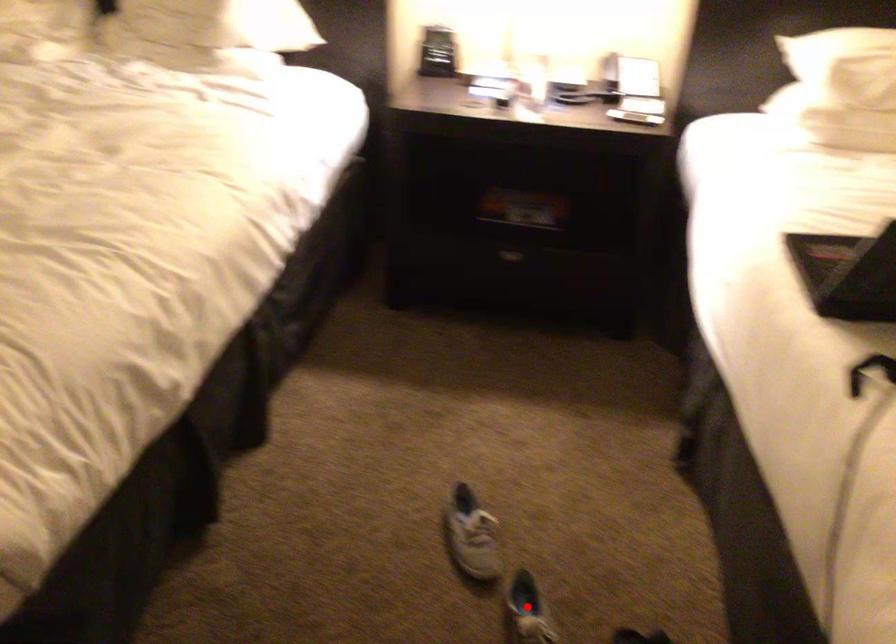
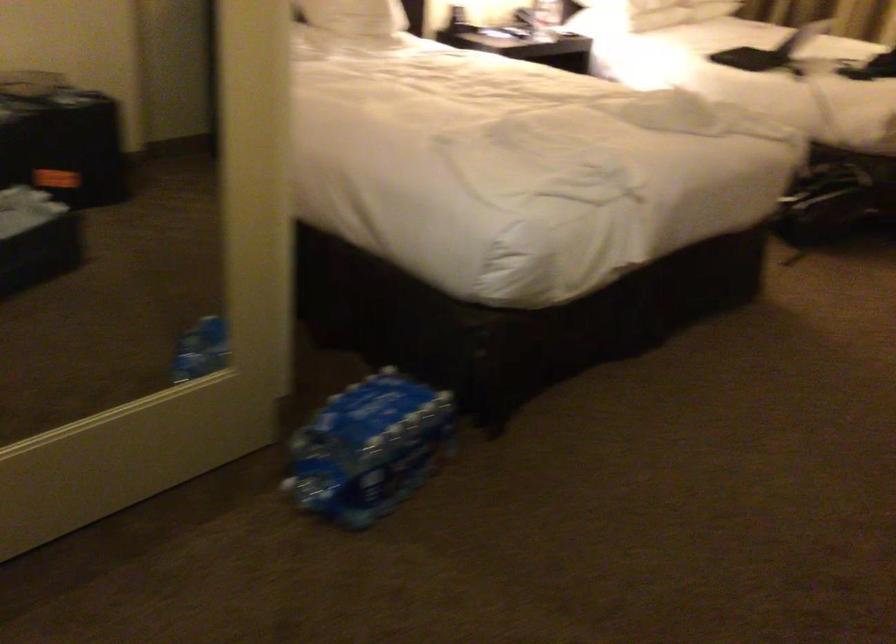
Question: I am providing you with two images of the same scene from different viewpoints. A red point is marked on the first image. Is the red point's position out of view in image 2?

Choices:
 (A) Yes
 (B) No

Answer: (A)